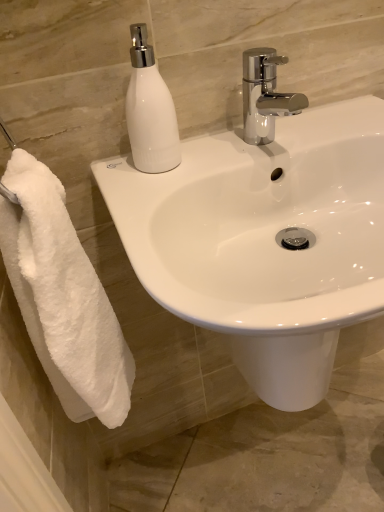
Where is `vacant area situated to the left side of chrome metallic faucet at upper center`? vacant area situated to the left side of chrome metallic faucet at upper center is located at coordinates (183, 163).